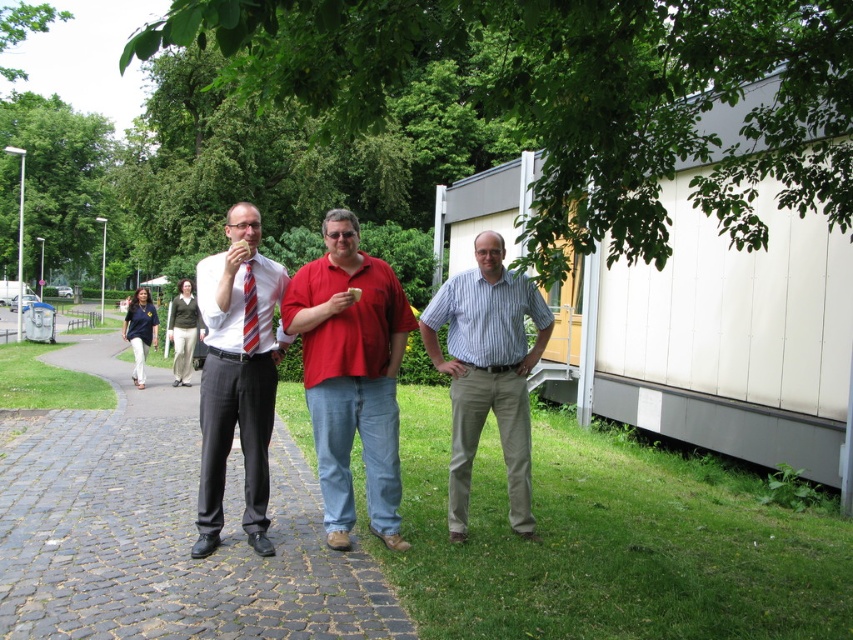
You are standing on the grassy area and want to walk towards the person wearing the red striped tie at center. Which direction should you walk to avoid passing through the matte black suit at left?

Since the matte black suit at left is to the left of the red striped tie at center, you should walk towards the right side to avoid passing through the matte black suit at left and reach the red striped tie at center.